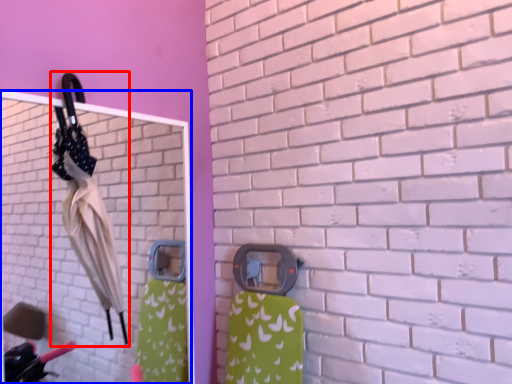
Question: Which object appears closest to the camera in this image, umbrella (highlighted by a red box) or mirror (highlighted by a blue box)?

Choices:
 (A) umbrella
 (B) mirror

Answer: (B)